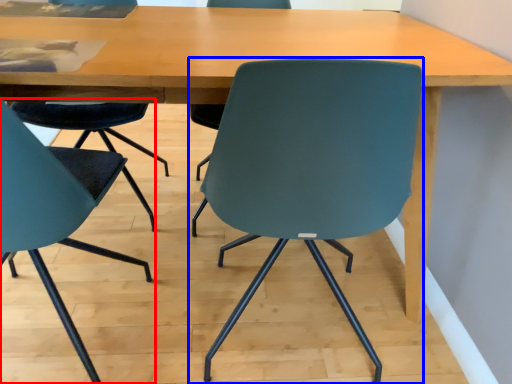
Question: Which of the following is the farthest to the observer, chair (highlighted by a red box) or chair (highlighted by a blue box)?

Choices:
 (A) chair
 (B) chair

Answer: (B)